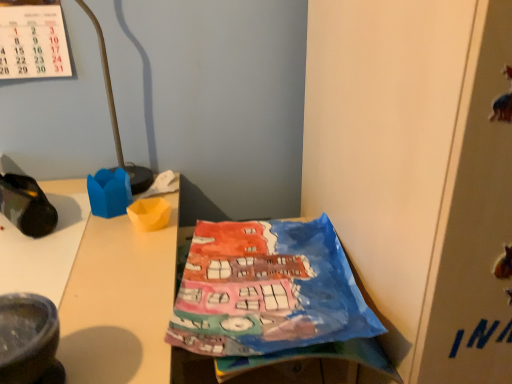
Question: Is point (54, 150) positioned closer to the camera than point (274, 314)?

Choices:
 (A) farther
 (B) closer

Answer: (A)

Question: Considering the positions of metallic gold lamp at upper left and watercolor paper at center in the image, is metallic gold lamp at upper left wider or thinner than watercolor paper at center?

Choices:
 (A) thin
 (B) wide

Answer: (A)

Question: Considering the real-world distances, which object is farthest from the watercolor paper at center?

Choices:
 (A) metallic gold lamp at upper left
 (B) camouflage fabric shoe at left

Answer: (A)

Question: Which of these objects is positioned farthest from the watercolor paper at center?

Choices:
 (A) metallic gold lamp at upper left
 (B) camouflage fabric shoe at left

Answer: (A)